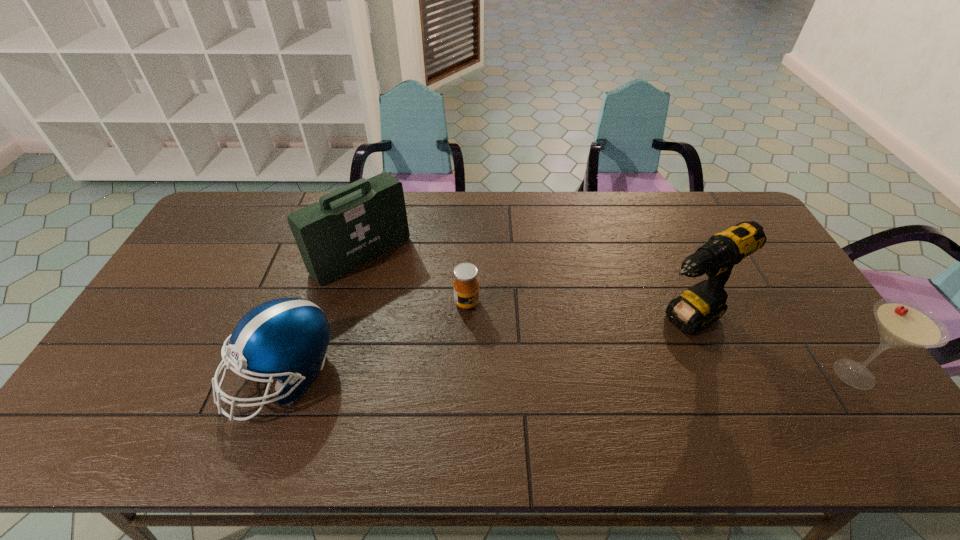
Where is `free space between the football helmet and the martini`? This screenshot has height=540, width=960. free space between the football helmet and the martini is located at coordinates (568, 375).

This screenshot has width=960, height=540. I want to click on unoccupied position between the third object from right to left and the farthest object, so click(414, 279).

Identify the location of blank region between the third object from right to left and the tallest object. The height and width of the screenshot is (540, 960). (575, 311).

Identify the location of vacant space that is in between the football helmet and the honey. This screenshot has width=960, height=540. (375, 339).

What are the coordinates of `vacant point located between the tallest object and the third object from left to right` in the screenshot? It's located at (575, 311).

The height and width of the screenshot is (540, 960). I want to click on vacant space in between the third object from right to left and the fourth object from left to right, so click(575, 311).

The width and height of the screenshot is (960, 540). Identify the location of object that is the fourth closest to the third object from left to right. (x=902, y=324).

Choose which object is the nearest neighbor to the third object from right to left. Please provide its 2D coordinates. Your answer should be formatted as a tuple, i.e. [(x, y)], where the tuple contains the x and y coordinates of a point satisfying the conditions above.

[(350, 226)]

The image size is (960, 540). Find the location of `free space that satisfies the following two spatial constraints: 1. on the front side of the rightmost object; 2. on the right side of the first-aid kit`. free space that satisfies the following two spatial constraints: 1. on the front side of the rightmost object; 2. on the right side of the first-aid kit is located at coordinates pyautogui.click(x=329, y=374).